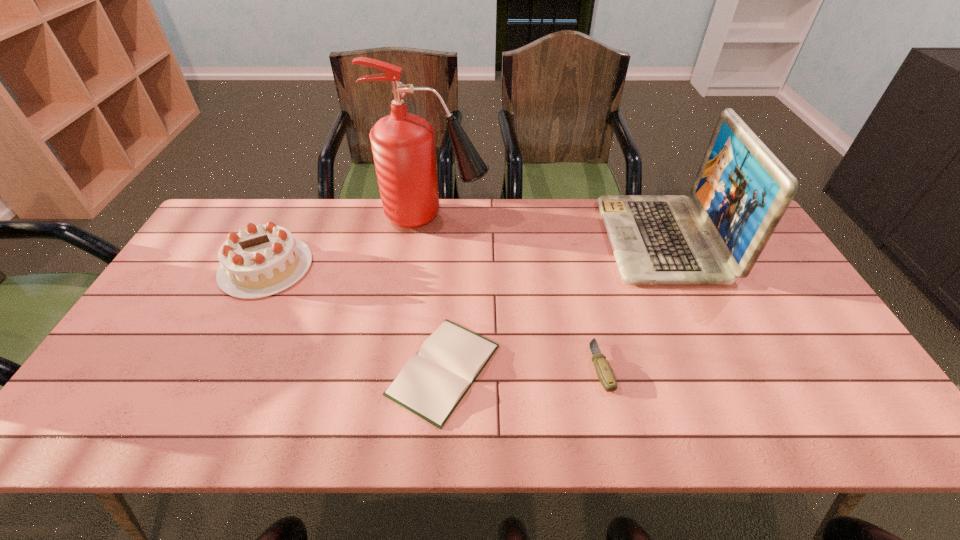
Image resolution: width=960 pixels, height=540 pixels. I want to click on the tallest object, so click(403, 145).

Where is `the rightmost object`? The image size is (960, 540). the rightmost object is located at coordinates (742, 190).

Where is `the second tallest object`? the second tallest object is located at coordinates (742, 190).

At what (x,y) coordinates should I click in order to perform the action: click on the third shortest object. Please return your answer as a coordinate pair (x, y). Looking at the image, I should click on (263, 260).

Locate an element on the screen. The width and height of the screenshot is (960, 540). birthday cake is located at coordinates (263, 260).

The height and width of the screenshot is (540, 960). I want to click on the second shortest object, so click(605, 374).

At what (x,y) coordinates should I click in order to perform the action: click on pocketknife. Please return your answer as a coordinate pair (x, y). The height and width of the screenshot is (540, 960). Looking at the image, I should click on (605, 374).

Identify the location of the shortest object. (432, 383).

Locate an element on the screen. vacant point located with the nozzle aimed from the fire extinguisher is located at coordinates (579, 216).

This screenshot has width=960, height=540. I want to click on vacant area situated on the screen of the fourth shortest object, so click(551, 239).